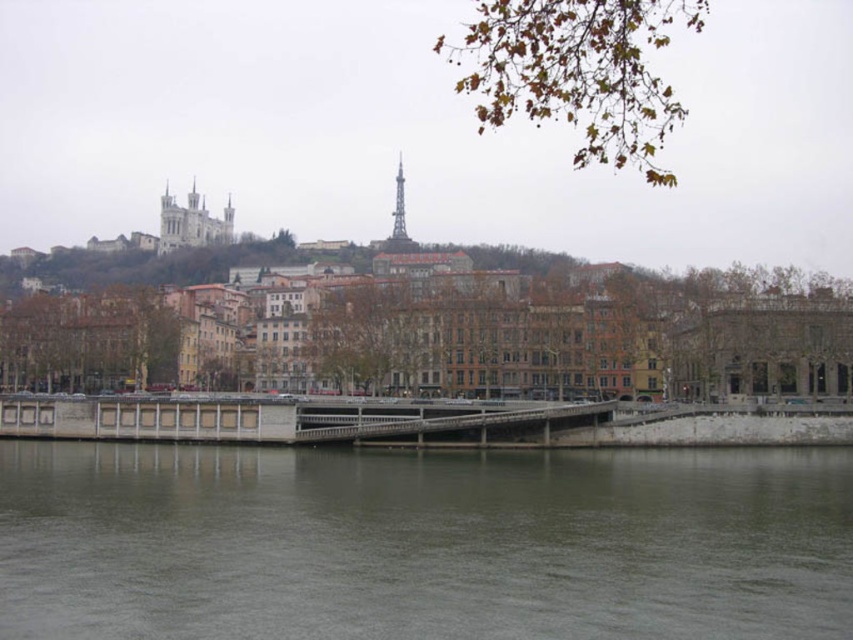
Question: Can you confirm if gray concrete river at lower center is positioned above concrete bridge at center?

Choices:
 (A) yes
 (B) no

Answer: (B)

Question: Which point is farther from the camera taking this photo?

Choices:
 (A) (840, 516)
 (B) (57, 433)

Answer: (B)

Question: Does gray concrete river at lower center come in front of concrete bridge at center?

Choices:
 (A) no
 (B) yes

Answer: (B)

Question: Does gray concrete river at lower center appear over concrete bridge at center?

Choices:
 (A) yes
 (B) no

Answer: (B)